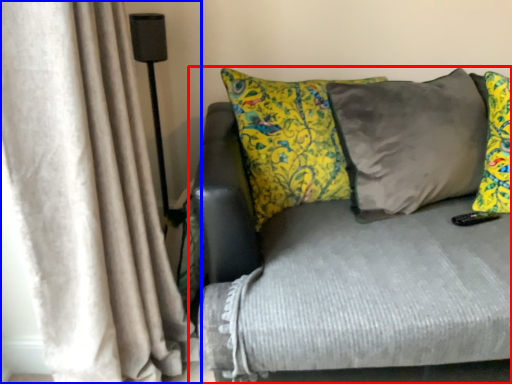
Question: Among these objects, which one is farthest to the camera, studio couch (highlighted by a red box) or curtain (highlighted by a blue box)?

Choices:
 (A) studio couch
 (B) curtain

Answer: (A)